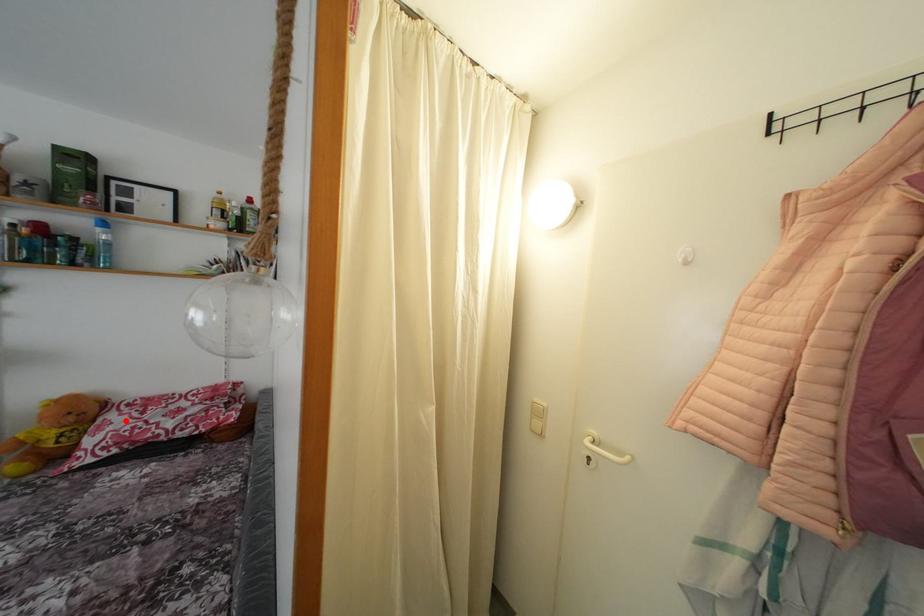
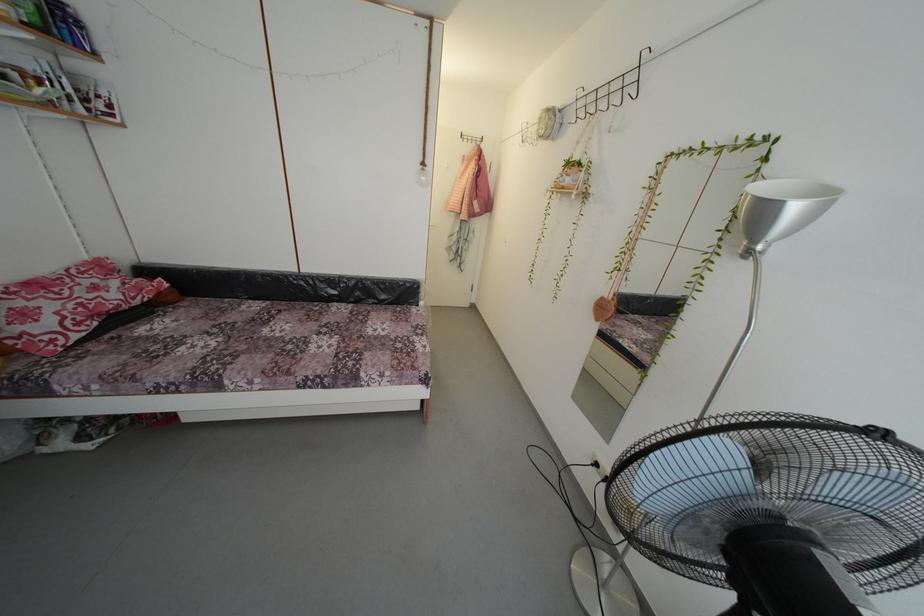
In the second image, find the point that corresponds to the highlighted location in the first image.

(34, 306)